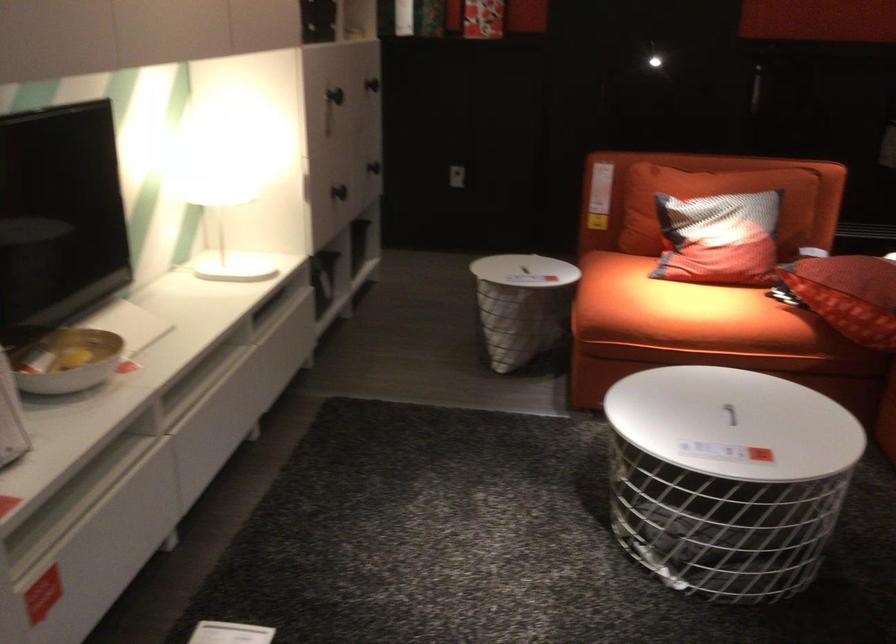
Where would you sit the sofa sitting surface? Please return your answer as a coordinate pair (x, y).

(684, 312)